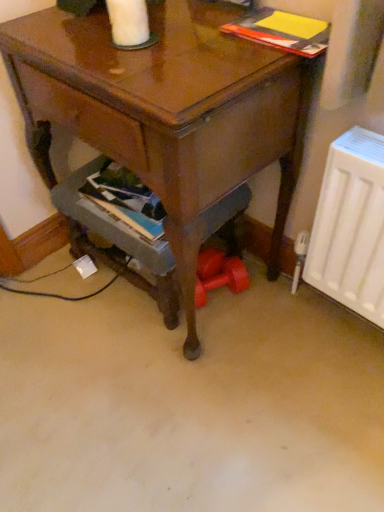
The width and height of the screenshot is (384, 512). Identify the location of vacant region to the left of shiny brown desk at center. (53, 315).